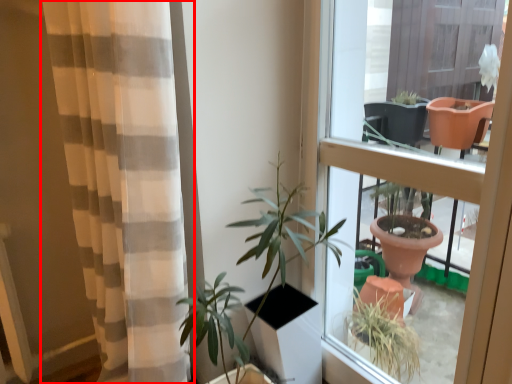
Question: Considering the relative positions of curtain (annotated by the red box) and window in the image provided, where is curtain (annotated by the red box) located with respect to the staircase?

Choices:
 (A) left
 (B) right

Answer: (A)